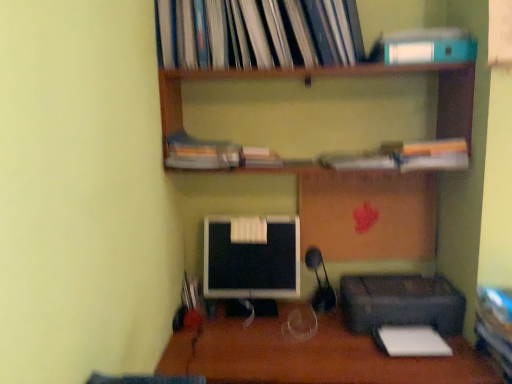
At what (x,y) coordinates should I click in order to perform the action: click on free space in front of black glossy monitor at center. Please return your answer as a coordinate pair (x, y). Looking at the image, I should click on [x=252, y=336].